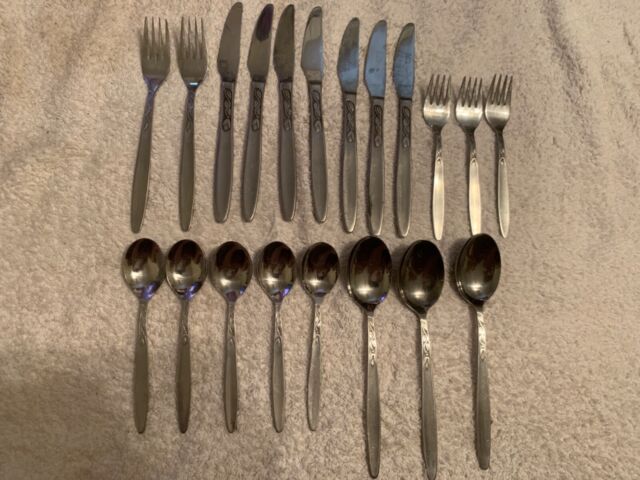
This screenshot has height=480, width=640. Identify the location of forks. (153, 69), (192, 63), (435, 108), (474, 107), (502, 108).